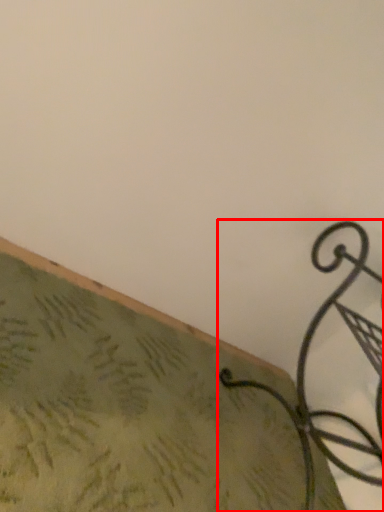
Question: From the image, what is the correct spatial relationship of furniture (annotated by the red box) in relation to surface?

Choices:
 (A) left
 (B) right

Answer: (B)